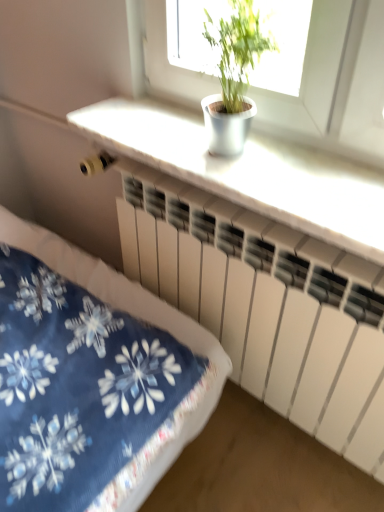
Locate an element on the screen. The width and height of the screenshot is (384, 512). free point above white matte radiator at center (from a real-world perspective) is located at coordinates (250, 221).